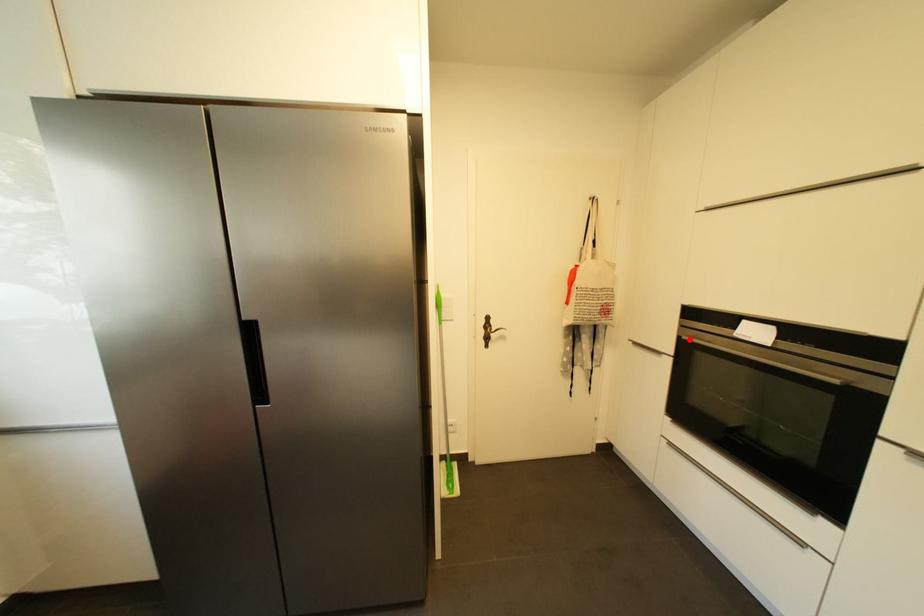
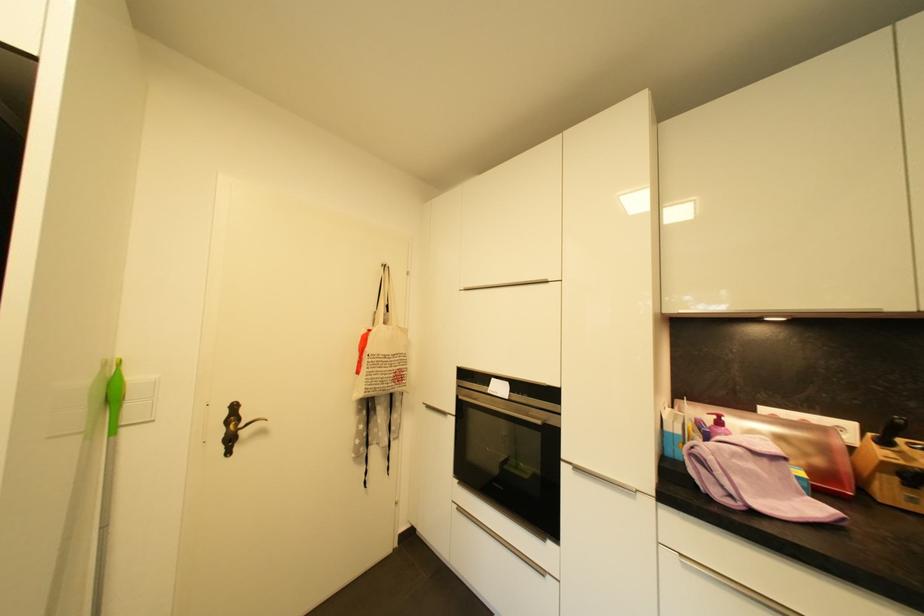
Question: A red point is marked in image1. In image2, is the corresponding 3D point closer to the camera or farther? Reply with the corresponding letter.

Choices:
 (A) The corresponding 3D point is closer.
 (B) The corresponding 3D point is farther.

Answer: (B)